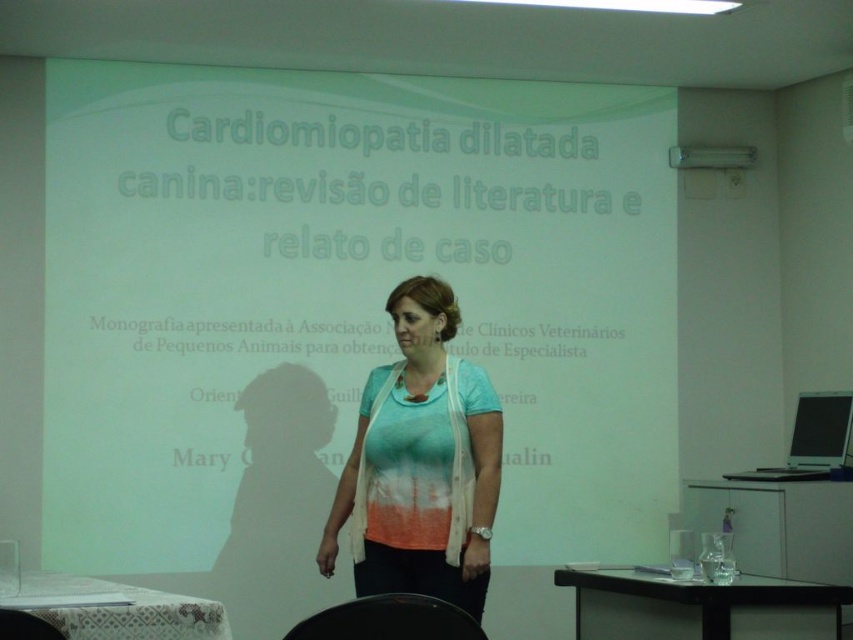
What do you see at coordinates (347, 294) in the screenshot? Image resolution: width=853 pixels, height=640 pixels. I see `white matte projection screen at center` at bounding box center [347, 294].

Does point (138, 168) lie in front of point (459, 573)?

No.

Where is `white matte projection screen at center`? This screenshot has height=640, width=853. white matte projection screen at center is located at coordinates (347, 294).